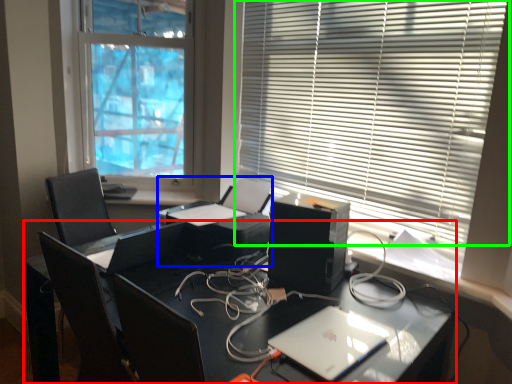
Question: Based on their relative distances, which object is nearer to desk (highlighted by a red box)? Choose from printer (highlighted by a blue box) and window blind (highlighted by a green box).

Choices:
 (A) printer
 (B) window blind

Answer: (A)